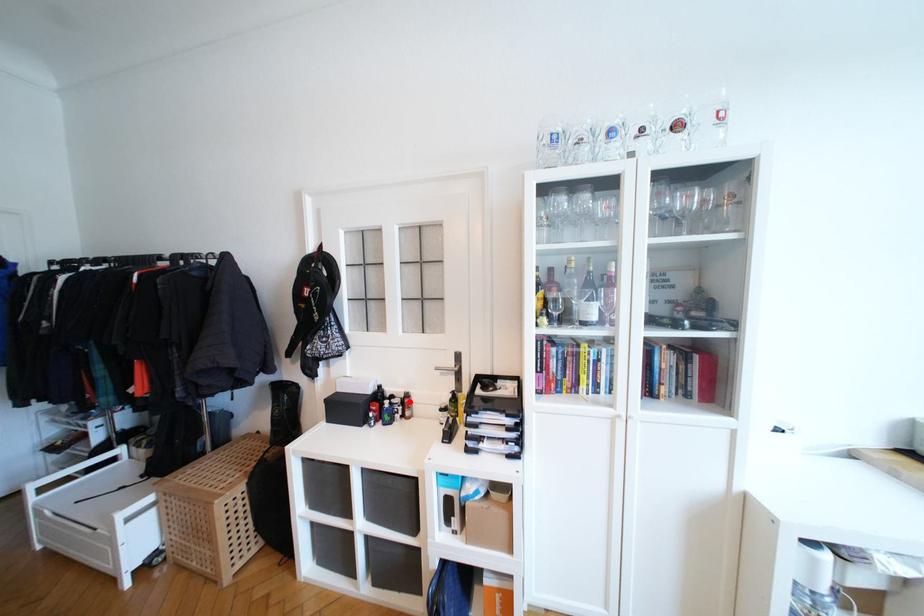
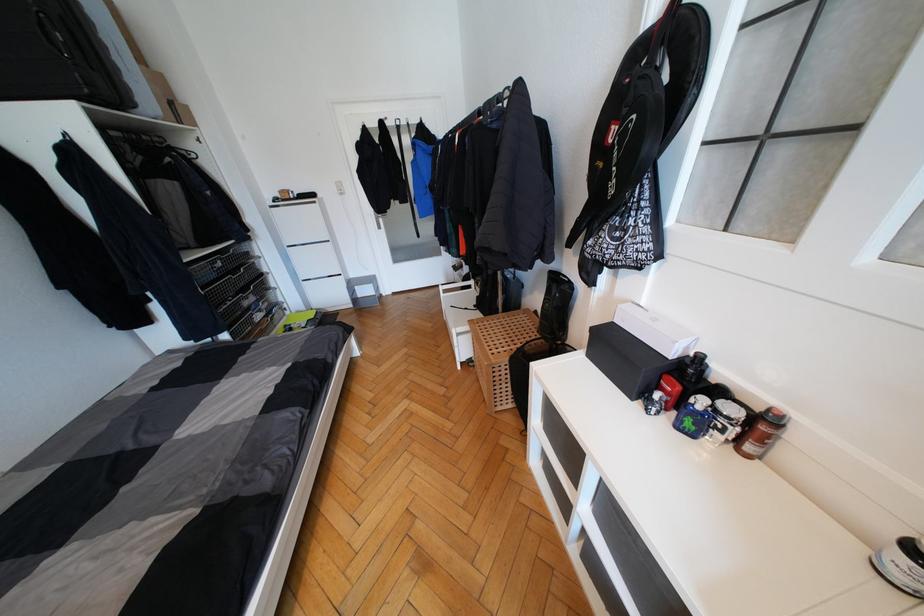
Find the pixel in the second image that matches the highlighted location in the first image.

(767, 429)